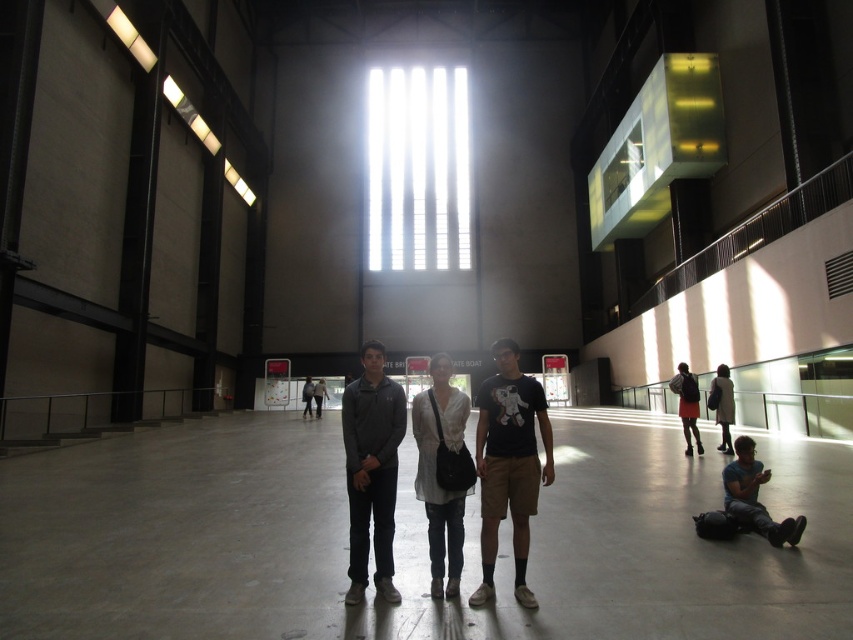
Question: Which of the following is the farthest from the observer?

Choices:
 (A) dark gray sweater at center
 (B) black cotton t-shirt at center

Answer: (A)

Question: Which point is closer to the camera?

Choices:
 (A) (677, 388)
 (B) (730, 515)

Answer: (B)

Question: Which of the following is the farthest from the observer?

Choices:
 (A) dark gray sweater at center
 (B) matte black jacket at center
 (C) white cotton jacket at lower right
 (D) black cotton t-shirt at center

Answer: (C)

Question: Is black cotton t-shirt at center bigger than white cotton jacket at lower right?

Choices:
 (A) no
 (B) yes

Answer: (B)

Question: Is matte black jacket at center closer to the viewer compared to blue denim jeans at lower right?

Choices:
 (A) yes
 (B) no

Answer: (A)

Question: Is black cotton t-shirt at center smaller than orange skirt at center?

Choices:
 (A) yes
 (B) no

Answer: (B)